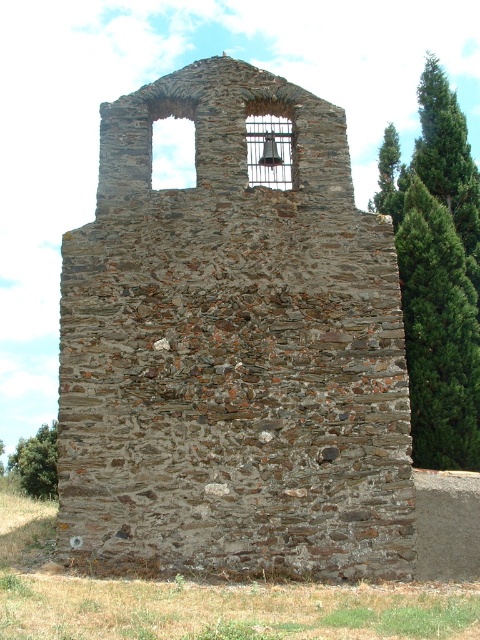
You are standing at the base of the bell tower and notice two points marked on the structure. The first point is at coordinate (454, 310), and the second is at (46, 435). From your perspective, which point appears closer to you?

Point (454, 310) is in front of point (46, 435), so it appears closer to you.

You are standing in front of the brown stone bell tower at upper center. If you want to take a photo of it from the front, where should you position yourself relative to the tower?

Since the brown stone bell tower at upper center is located at coordinates approximately 0.548 on the x axis and 0.485 on the y axis, you should position yourself directly in front of it along the central axis to capture the front view.

You are standing in front of the weathered stone structure and notice two green leafy trees. Which tree, the green leafy tree at right or the green leafy tree at lower left, appears larger in size?

The green leafy tree at right appears larger in size compared to the green leafy tree at lower left as it is bigger according to the description.